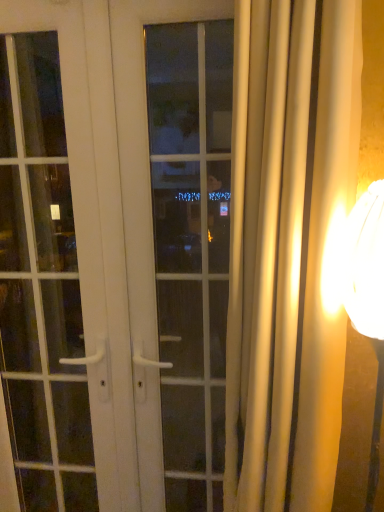
Question: Would you say matte gold lampshade at right is a long distance from white glossy door at center?

Choices:
 (A) no
 (B) yes

Answer: (A)

Question: Is matte gold lampshade at right located outside white glossy door at center?

Choices:
 (A) no
 (B) yes

Answer: (B)

Question: Considering the relative sizes of matte gold lampshade at right and white glossy door at center in the image provided, is matte gold lampshade at right smaller than white glossy door at center?

Choices:
 (A) no
 (B) yes

Answer: (B)

Question: Does matte gold lampshade at right contain white glossy door at center?

Choices:
 (A) yes
 (B) no

Answer: (B)

Question: Is matte gold lampshade at right aimed at white glossy door at center?

Choices:
 (A) yes
 (B) no

Answer: (B)

Question: Considering the relative sizes of matte gold lampshade at right and white glossy door at center in the image provided, is matte gold lampshade at right wider than white glossy door at center?

Choices:
 (A) yes
 (B) no

Answer: (A)

Question: Does white glass window at center appear on the right side of matte gold lampshade at right?

Choices:
 (A) yes
 (B) no

Answer: (B)

Question: From a real-world perspective, is white glass window at center on top of matte gold lampshade at right?

Choices:
 (A) no
 (B) yes

Answer: (B)

Question: Does white glass window at center have a lesser height compared to matte gold lampshade at right?

Choices:
 (A) no
 (B) yes

Answer: (A)

Question: Is white glass window at center positioned beyond the bounds of matte gold lampshade at right?

Choices:
 (A) yes
 (B) no

Answer: (A)

Question: Considering the relative sizes of white glass window at center and matte gold lampshade at right in the image provided, is white glass window at center thinner than matte gold lampshade at right?

Choices:
 (A) yes
 (B) no

Answer: (A)

Question: Can you confirm if white glass window at center is positioned to the left of matte gold lampshade at right?

Choices:
 (A) no
 (B) yes

Answer: (B)

Question: Is white glossy door at center thinner than white glossy door handle at left?

Choices:
 (A) yes
 (B) no

Answer: (A)